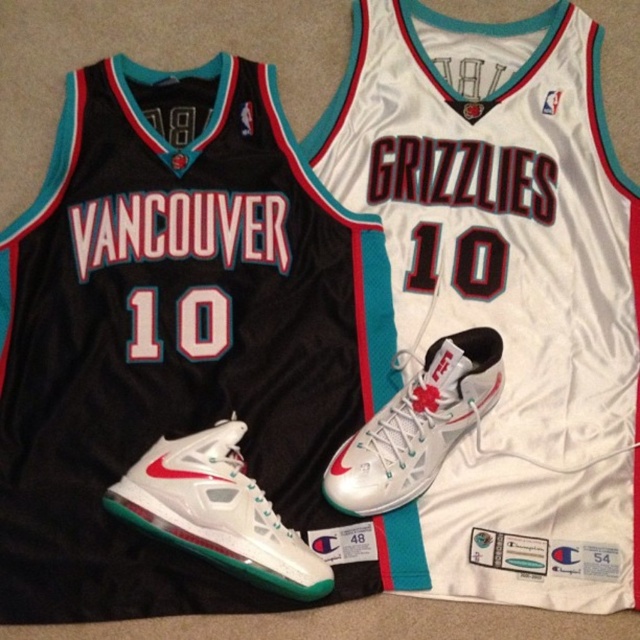
Does white mesh shoe at center appear on the left side of metallic silver sneaker at center?

Yes, white mesh shoe at center is to the left of metallic silver sneaker at center.

Does white mesh shoe at center appear on the right side of metallic silver sneaker at center?

In fact, white mesh shoe at center is to the left of metallic silver sneaker at center.

Who is more forward, (269, 554) or (454, 372)?

Positioned in front is point (269, 554).

Find the location of a particular element. Image resolution: width=640 pixels, height=640 pixels. white mesh shoe at center is located at coordinates (218, 512).

At what (x,y) coordinates should I click in order to perform the action: click on white matte jersey at center. Please return your answer as a coordinate pair (x, y). This screenshot has height=640, width=640. Looking at the image, I should click on click(x=499, y=292).

Does white matte jersey at center have a lesser height compared to metallic silver sneaker at center?

Incorrect, white matte jersey at center's height does not fall short of metallic silver sneaker at center's.

Which is behind, point (564, 509) or point (369, 461)?

The point (369, 461) is more distant.

Find the location of a particular element. This screenshot has width=640, height=640. white matte jersey at center is located at coordinates (499, 292).

Does white matte jersey at center have a greater width compared to white mesh shoe at center?

Yes, white matte jersey at center is wider than white mesh shoe at center.

In order to click on white matte jersey at center in this screenshot , I will do `click(499, 292)`.